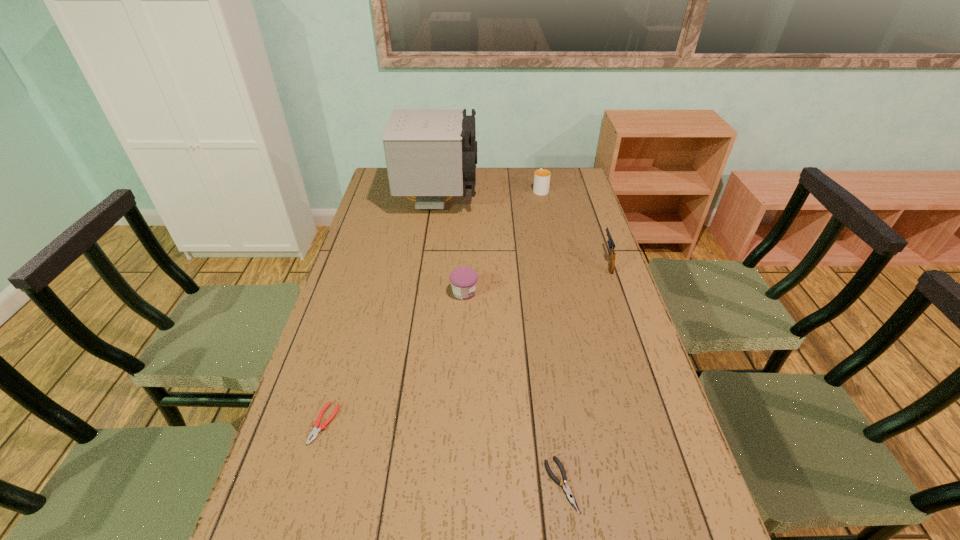
In order to click on the tallest object in this screenshot , I will do `click(430, 154)`.

Locate an element on the screen. This screenshot has width=960, height=540. the third farthest object is located at coordinates (611, 244).

Find the location of `gun`. gun is located at coordinates (611, 244).

You are a GUI agent. You are given a task and a screenshot of the screen. Output one action in this format:
    pyautogui.click(x=<x>, y=<y>)
    Task: Click on the cup
    
    Given the screenshot: What is the action you would take?
    pyautogui.click(x=541, y=177)

You are a GUI agent. You are given a task and a screenshot of the screen. Output one action in this format:
    pyautogui.click(x=<x>, y=<y>)
    Task: Click on the third shortest object
    
    Given the screenshot: What is the action you would take?
    pyautogui.click(x=463, y=280)

Locate an element on the screen. jam is located at coordinates [x=463, y=280].

Image resolution: width=960 pixels, height=540 pixels. Identify the location of the nearest object. (570, 496).

This screenshot has width=960, height=540. I want to click on the nearer pliers, so click(x=570, y=496).

Locate an element on the screen. the leftmost object is located at coordinates (315, 431).

Where is `the left pliers`? the left pliers is located at coordinates (315, 431).